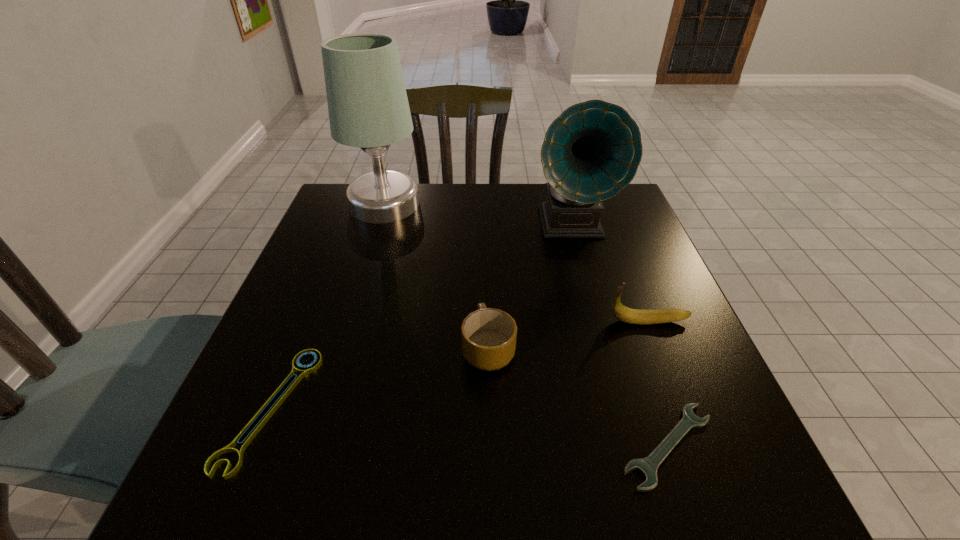
In the image, there is a desktop. Identify the location of free space at the left edge. (333, 356).

The image size is (960, 540). What are the coordinates of `vacant space at the right edge of the desktop` in the screenshot? It's located at (597, 267).

This screenshot has height=540, width=960. Identify the location of vacant space at the far left corner. (339, 226).

At what (x,y) coordinates should I click in order to perform the action: click on vacant space at the near left corner of the desktop. Please return your answer as a coordinate pair (x, y). Looking at the image, I should click on (285, 462).

Locate an element on the screen. The height and width of the screenshot is (540, 960). free space at the near right corner of the desktop is located at coordinates (729, 507).

Image resolution: width=960 pixels, height=540 pixels. Identify the location of free spot between the right wrench and the fifth shortest object. (619, 335).

Locate an element on the screen. blank region between the third object from left to right and the lampshade is located at coordinates (437, 276).

Identify the location of free spot between the left wrench and the right wrench. The image size is (960, 540). (469, 427).

Identify the location of vacant region between the phonograph_record and the banana. (610, 273).

This screenshot has width=960, height=540. Identify the location of blank region between the banana and the right wrench. (659, 383).